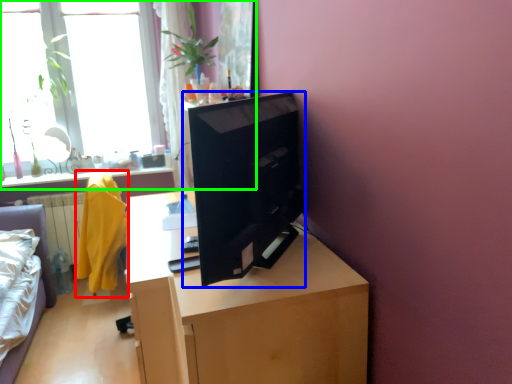
Question: Which is farther away from robe (highlighted by a red box)? computer (highlighted by a blue box) or window (highlighted by a green box)?

Choices:
 (A) computer
 (B) window

Answer: (A)